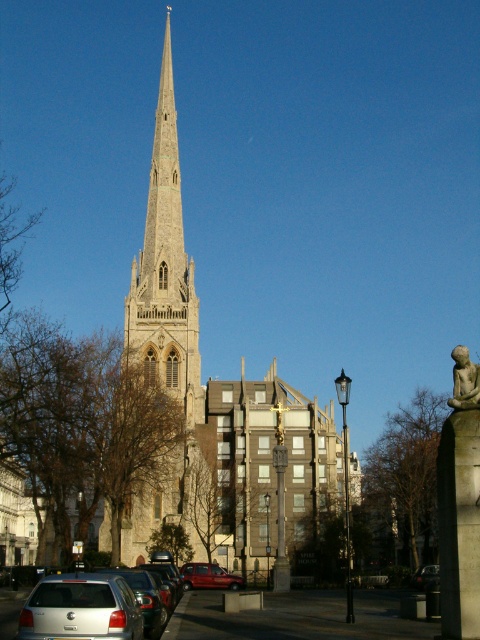
You are a parking attendant who needs to fit both the silver metallic car at lower left and the shiny black car at lower center into a parking spot that is 2 meters wide. Based on their widths, which car might not fit if the spot is exactly 2 meters wide?

The silver metallic car at lower left has a greater width than the shiny black car at lower center. If the parking spot is exactly 2 meters wide, the silver metallic car at lower left might not fit since it is wider than the shiny black car at lower center.

You are a photographer trying to capture the stone steeple at center and the silver metallic car at lower left in the same frame. Based on their sizes, which object should you focus on first to ensure both fit in the photo?

The stone steeple at center is wider than the silver metallic car at lower left, so you should focus on capturing the stone steeple at center first to ensure both fit in the frame.